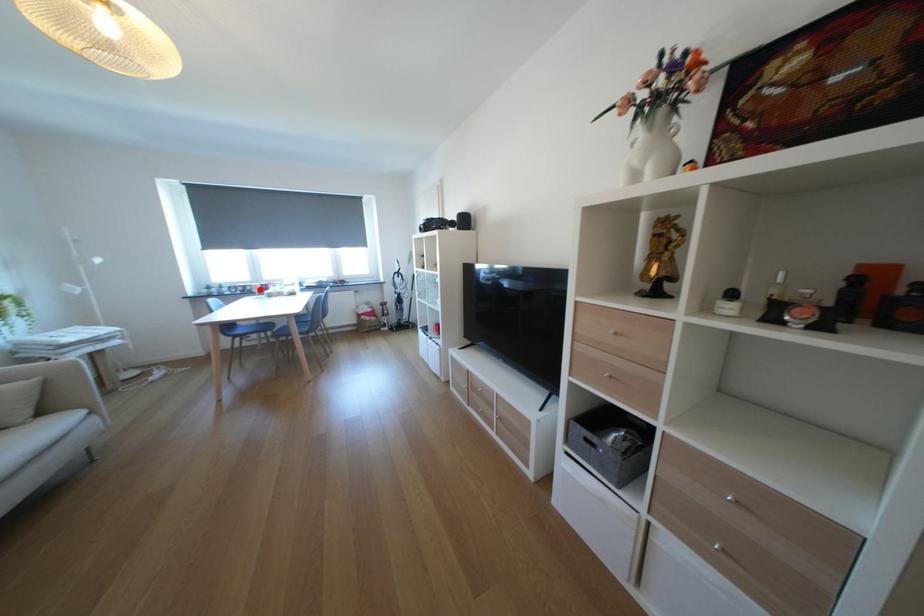
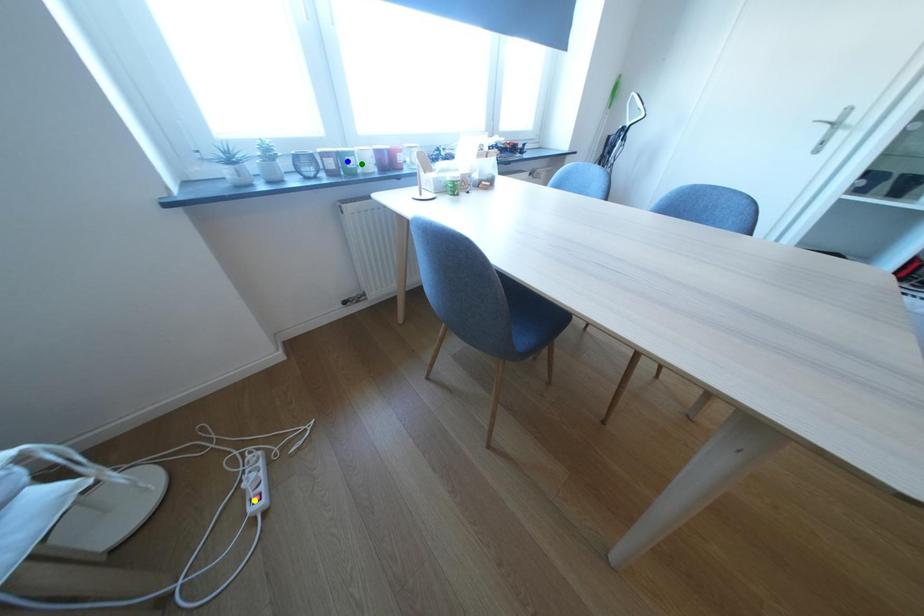
Question: I am providing you with two images of the same scene from different viewpoints. A red point is marked on the first image. You are given multiple points on the second image. Which mark in image 2 goes with the point in image 1?

Choices:
 (A) blue point
 (B) green point
 (C) yellow point

Answer: (B)